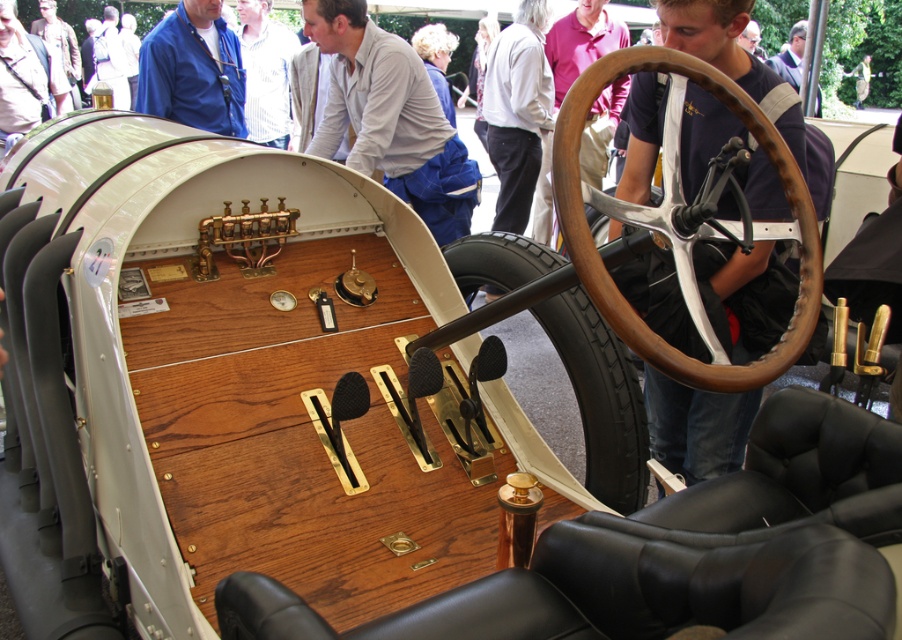
Which is behind, point (235, 100) or point (568, 80)?

The point (568, 80) is behind.

Which is above, blue denim shirt at upper left or dark purple shirt at center?

dark purple shirt at center

Is point (212, 115) positioned before point (572, 58)?

Yes, it is in front of point (572, 58).

Identify the location of blue denim shirt at upper left. (191, 76).

How much distance is there between wooden/leather steering wheel at center and black rubber tire at center?

wooden/leather steering wheel at center and black rubber tire at center are 36.75 inches apart from each other.

Is wooden/leather steering wheel at center shorter than black rubber tire at center?

Correct, wooden/leather steering wheel at center is not as tall as black rubber tire at center.

Where is `wooden/leather steering wheel at center`? wooden/leather steering wheel at center is located at coordinates (603, 266).

Does white cotton shirt at upper center have a lesser height compared to dark purple shirt at center?

No, white cotton shirt at upper center is not shorter than dark purple shirt at center.

Is the position of white cotton shirt at upper center less distant than that of dark purple shirt at center?

Yes, white cotton shirt at upper center is closer to the viewer.

Who is more forward, (540, 12) or (613, 96)?

Point (540, 12) is more forward.

Image resolution: width=902 pixels, height=640 pixels. What are the coordinates of `white cotton shirt at upper center` in the screenshot? It's located at (517, 112).